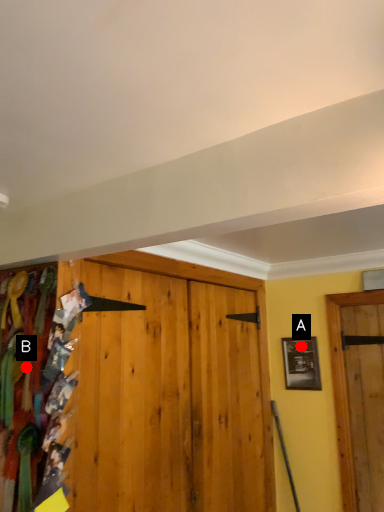
Question: Two points are circled on the image, labeled by A and B beside each circle. Which point is closer to the camera?

Choices:
 (A) A is closer
 (B) B is closer

Answer: (B)